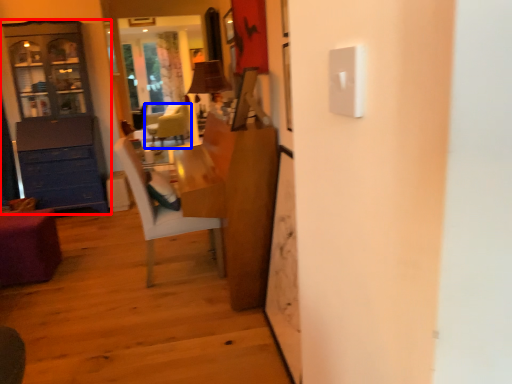
Question: Which point is closer to the camera, cabinetry (highlighted by a red box) or chair (highlighted by a blue box)?

Choices:
 (A) cabinetry
 (B) chair

Answer: (A)